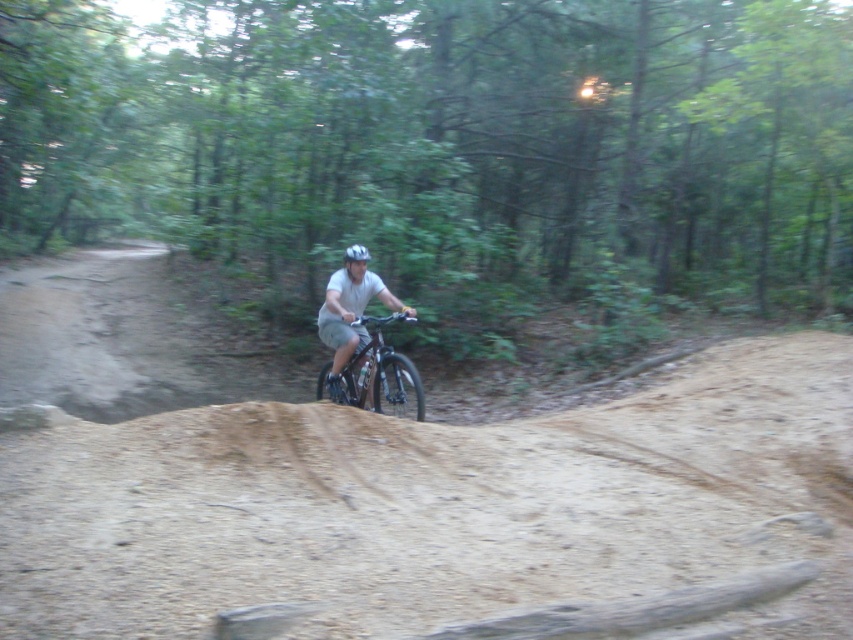
Who is shorter, brown sandy dirt at center or shiny metallic bicycle at center?

Standing shorter between the two is brown sandy dirt at center.

Does point (300, 570) lie in front of point (375, 397)?

Yes, point (300, 570) is in front of point (375, 397).

The image size is (853, 640). What are the coordinates of `brown sandy dirt at center` in the screenshot? It's located at (450, 515).

Does brown sandy dirt at center appear under white matte bicycle helmet at center?

Yes, brown sandy dirt at center is below white matte bicycle helmet at center.

In the scene shown: Does brown sandy dirt at center come in front of white matte bicycle helmet at center?

Yes, it is in front of white matte bicycle helmet at center.

The width and height of the screenshot is (853, 640). Describe the element at coordinates (450, 515) in the screenshot. I see `brown sandy dirt at center` at that location.

Locate an element on the screen. This screenshot has width=853, height=640. brown sandy dirt at center is located at coordinates (450, 515).

Between point (387, 368) and point (346, 253), which one is positioned in front?

Positioned in front is point (346, 253).

Can you confirm if shiny metallic bicycle at center is wider than white matte bicycle helmet at center?

Indeed, shiny metallic bicycle at center has a greater width compared to white matte bicycle helmet at center.

Measure the distance between point (x=341, y=385) and camera.

A distance of 9.78 meters exists between point (x=341, y=385) and camera.

You are a GUI agent. You are given a task and a screenshot of the screen. Output one action in this format:
    pyautogui.click(x=<x>, y=<y>)
    Task: Click on the shiny metallic bicycle at center
    
    Given the screenshot: What is the action you would take?
    pyautogui.click(x=381, y=372)